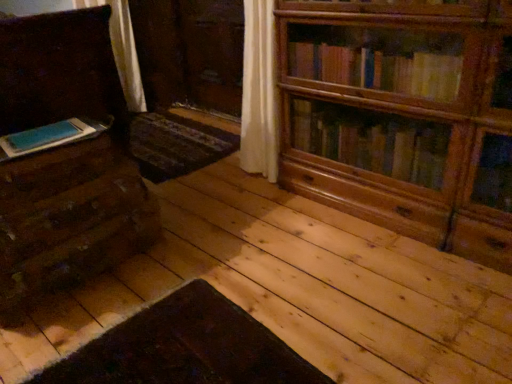
Question: Is blue matte book at left not inside matte brown chest of drawers at left?

Choices:
 (A) yes
 (B) no

Answer: (A)

Question: From the image's perspective, is blue matte book at left located above matte brown chest of drawers at left?

Choices:
 (A) no
 (B) yes

Answer: (A)

Question: Is blue matte book at left at the left side of matte brown chest of drawers at left?

Choices:
 (A) no
 (B) yes

Answer: (A)

Question: Is blue matte book at left beside matte brown chest of drawers at left?

Choices:
 (A) no
 (B) yes

Answer: (A)

Question: Considering the relative sizes of blue matte book at left and matte brown chest of drawers at left in the image provided, is blue matte book at left smaller than matte brown chest of drawers at left?

Choices:
 (A) no
 (B) yes

Answer: (B)

Question: Is the position of blue matte book at left less distant than that of matte brown chest of drawers at left?

Choices:
 (A) yes
 (B) no

Answer: (B)

Question: Can you confirm if wooden bookcase at upper right is smaller than matte brown chest of drawers at left?

Choices:
 (A) yes
 (B) no

Answer: (A)

Question: Is wooden bookcase at upper right facing towards matte brown chest of drawers at left?

Choices:
 (A) no
 (B) yes

Answer: (A)

Question: Is wooden bookcase at upper right further to the viewer compared to matte brown chest of drawers at left?

Choices:
 (A) yes
 (B) no

Answer: (B)

Question: From a real-world perspective, is wooden bookcase at upper right over matte brown chest of drawers at left?

Choices:
 (A) no
 (B) yes

Answer: (A)

Question: Does wooden bookcase at upper right have a greater height compared to matte brown chest of drawers at left?

Choices:
 (A) yes
 (B) no

Answer: (B)

Question: Is wooden bookcase at upper right not within matte brown chest of drawers at left?

Choices:
 (A) yes
 (B) no

Answer: (A)

Question: Is wooden bookcase at upper right located within matte brown chest of drawers at left?

Choices:
 (A) no
 (B) yes

Answer: (A)